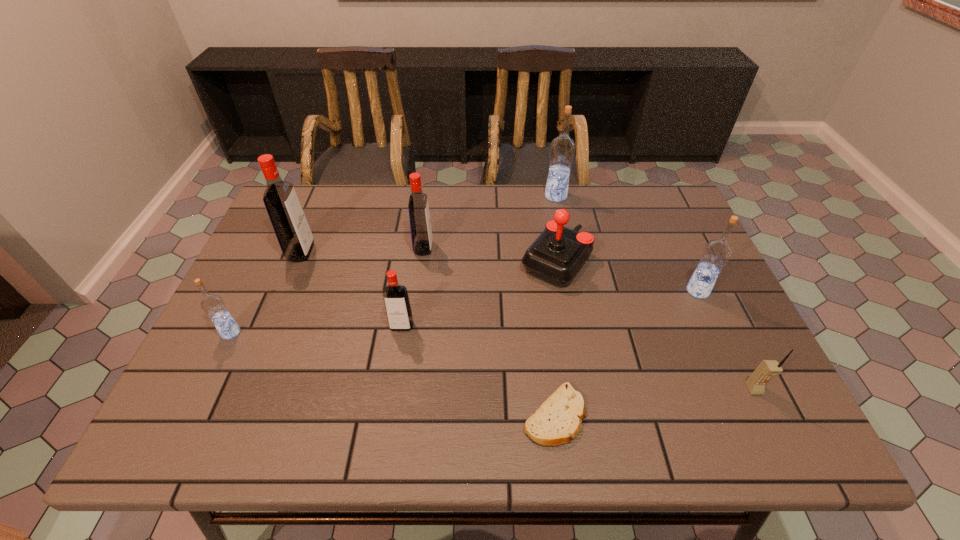
The height and width of the screenshot is (540, 960). In the image, there is a desktop. In order to click on vacant area at the far right corner in this screenshot , I will do `click(647, 195)`.

Locate an element on the screen. vacant space at the near right corner of the desktop is located at coordinates (729, 411).

In order to click on free space between the nearest blue vodka and the farthest vodka in this screenshot , I will do `click(394, 265)`.

Find the location of a particular element. The height and width of the screenshot is (540, 960). vacant area that lies between the red joystick and the third nearest vodka is located at coordinates (627, 276).

At what (x,y) coordinates should I click in order to perform the action: click on free space that is in between the leftmost vodka and the eighth tallest object. Please return your answer as a coordinate pair (x, y). Image resolution: width=960 pixels, height=540 pixels. Looking at the image, I should click on (492, 361).

The height and width of the screenshot is (540, 960). In order to click on free spot between the second biggest red vodka and the red joystick in this screenshot , I will do `click(490, 254)`.

The image size is (960, 540). Identify the location of vacant area between the biggest red vodka and the second biggest red vodka. (362, 250).

Find the location of a particular element. This screenshot has width=960, height=540. unoccupied area between the smallest blue vodka and the nearest red vodka is located at coordinates (316, 329).

Where is `vacant region between the smallest red vodka and the second shortest object`? vacant region between the smallest red vodka and the second shortest object is located at coordinates (578, 357).

Where is `empty space that is in between the second blue vodka from left to right and the rightmost blue vodka`? empty space that is in between the second blue vodka from left to right and the rightmost blue vodka is located at coordinates (627, 244).